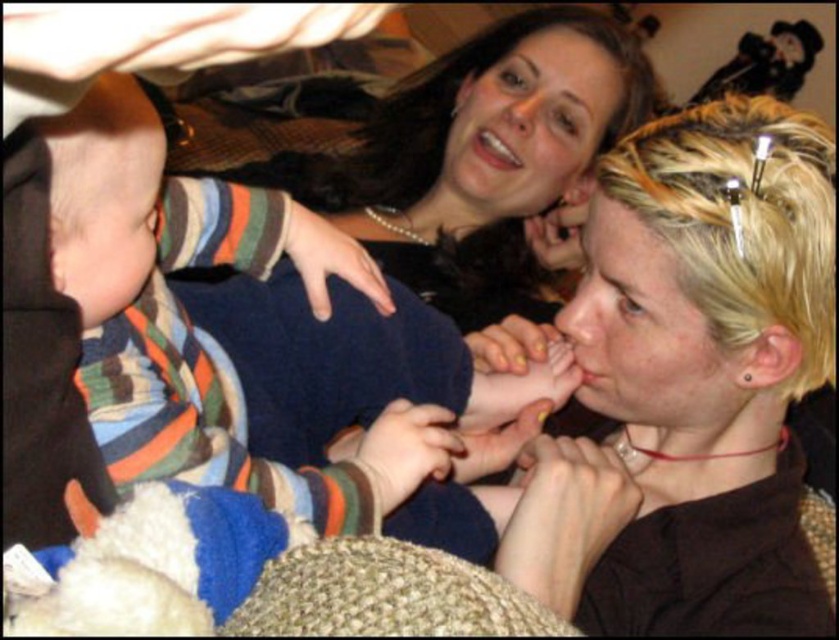
You are a photographer adjusting lighting for a closeup shot of the adult in the scene. You need to ensure both the smooth blonde hair at center and yellow painted nails at center are well lit. Considering their sizes, which object should you focus on first to ensure proper exposure?

The smooth blonde hair at center has a larger width than the yellow painted nails at center, so you should focus on the smooth blonde hair at center first to ensure proper exposure.

You are an interior designer assessing the placement of decorative items in a living room. You notice the smooth blonde hair at center and the matte silver ring at lower center. Which object has a greater width?

The smooth blonde hair at center has a greater width than the matte silver ring at lower center.